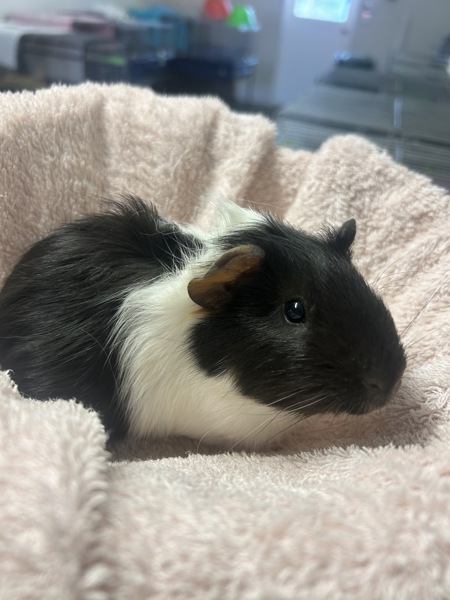
The image size is (450, 600). Find the location of `blanket`. blanket is located at coordinates (66, 151).